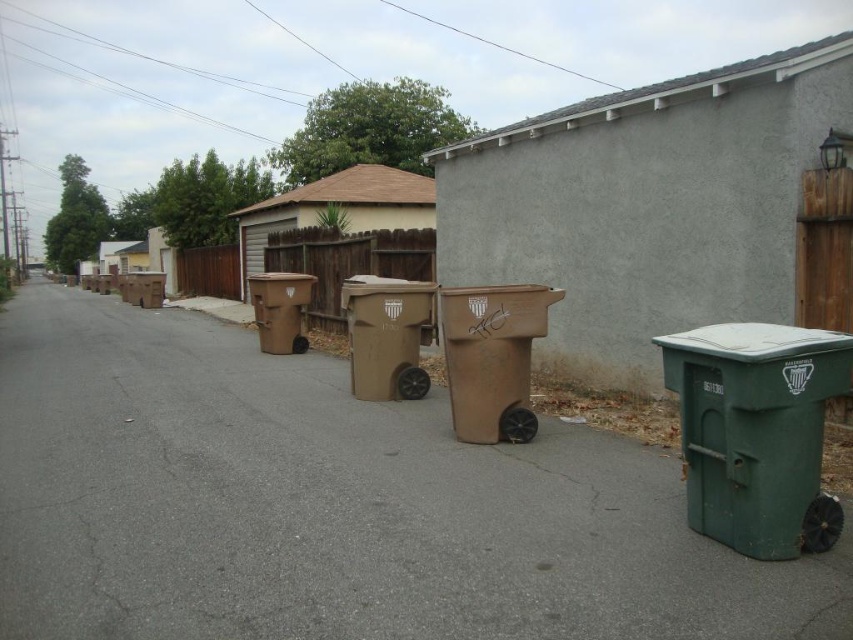
Does matte brown trash can at center have a lesser width compared to brown matte trash can at center?

No.

Between point (457, 328) and point (387, 388), which one is positioned behind?

Positioned behind is point (387, 388).

At what (x,y) coordinates should I click in order to perform the action: click on matte brown trash can at center. Please return your answer as a coordinate pair (x, y). This screenshot has width=853, height=640. Looking at the image, I should click on (492, 356).

Is point (811, 470) behind point (527, 298)?

No, it is not.

Who is taller, green plastic trash can at right or matte brown trash can at center?

matte brown trash can at center

Who is more distant from viewer, (675, 358) or (503, 429)?

Positioned behind is point (503, 429).

Locate an element on the screen. Image resolution: width=853 pixels, height=640 pixels. green plastic trash can at right is located at coordinates (757, 433).

Can you confirm if brown matte trash can at center is positioned below brown cardboard bin at center?

Yes.

The width and height of the screenshot is (853, 640). I want to click on brown matte trash can at center, so click(x=383, y=330).